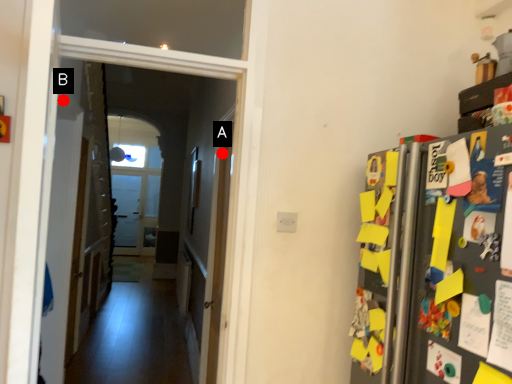
Question: Two points are circled on the image, labeled by A and B beside each circle. Which point is closer to the camera?

Choices:
 (A) A is closer
 (B) B is closer

Answer: (B)